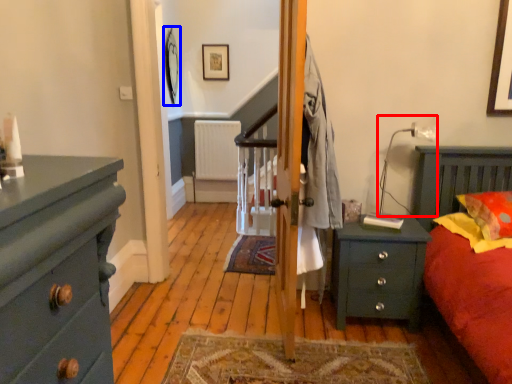
Question: Among these objects, which one is nearest to the camera, lamp (highlighted by a red box) or picture frame (highlighted by a blue box)?

Choices:
 (A) lamp
 (B) picture frame

Answer: (A)